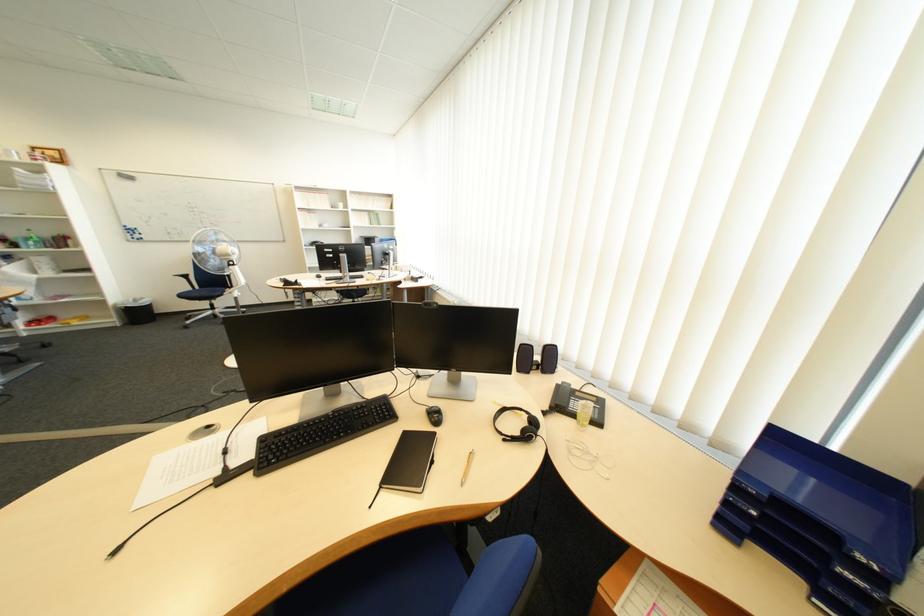
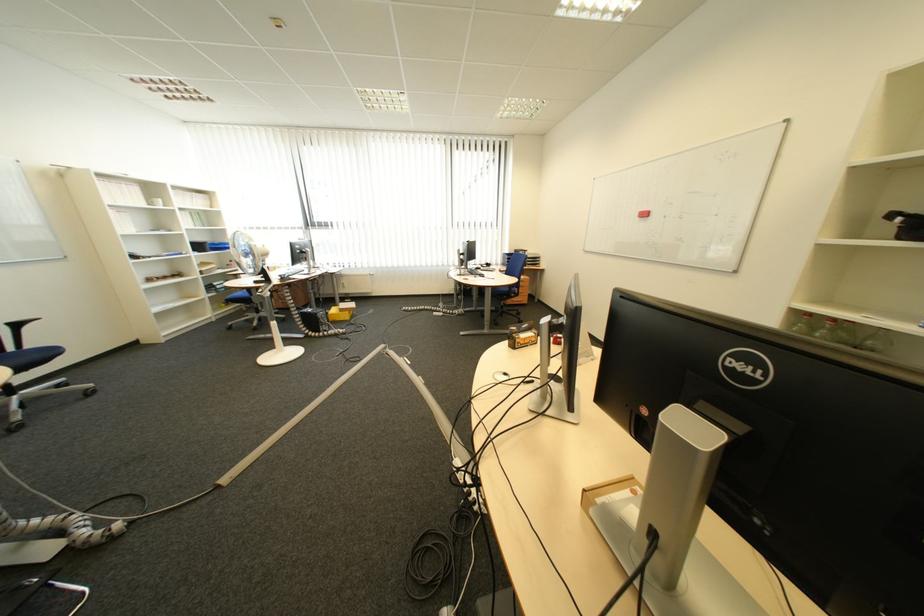
Question: I am providing you with two images of the same scene from different viewpoints. Please identify which objects are invisible in image2.

Choices:
 (A) shower handle
 (B) phone handset
 (C) blue chair sitting surface
 (D) blue binder

Answer: (B)